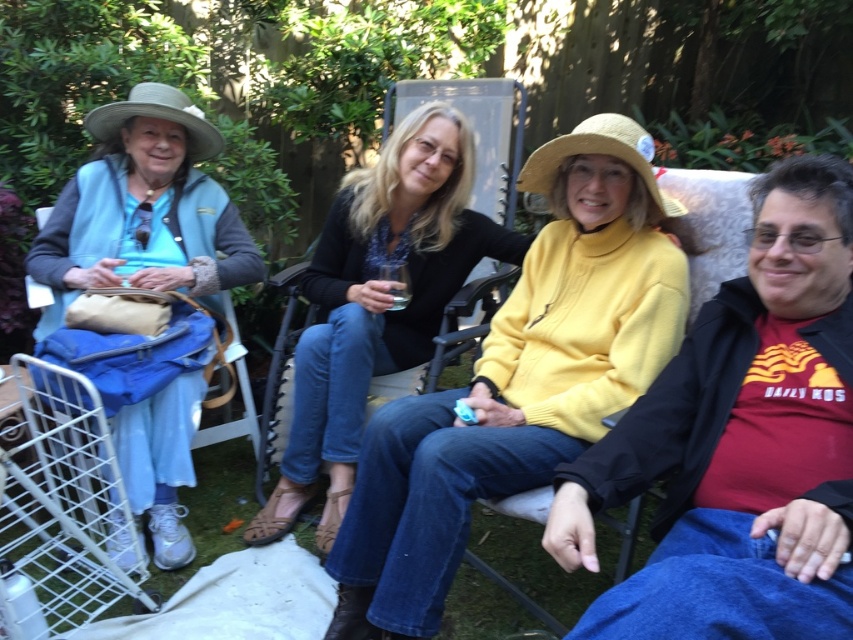
Question: From the image, what is the correct spatial relationship of yellow turtleneck sweater at center in relation to white wire shopping cart at lower left?

Choices:
 (A) below
 (B) above

Answer: (B)

Question: Can you confirm if light blue denim pants at left is positioned to the right of white wire shopping cart at lower left?

Choices:
 (A) yes
 (B) no

Answer: (A)

Question: Which point is farther from the camera taking this photo?

Choices:
 (A) (401, 209)
 (B) (189, 438)

Answer: (A)

Question: In this image, where is yellow woolen sweater at center located relative to white wire shopping cart at lower left?

Choices:
 (A) above
 (B) below

Answer: (A)

Question: Which object is positioned closest to the yellow woolen sweater at center?

Choices:
 (A) yellow turtleneck sweater at center
 (B) light blue denim pants at left

Answer: (A)

Question: Which object is positioned farthest from the light blue denim pants at left?

Choices:
 (A) white wire shopping cart at lower left
 (B) yellow turtleneck sweater at center
 (C) matte black sweater at center
 (D) yellow woolen sweater at center

Answer: (B)